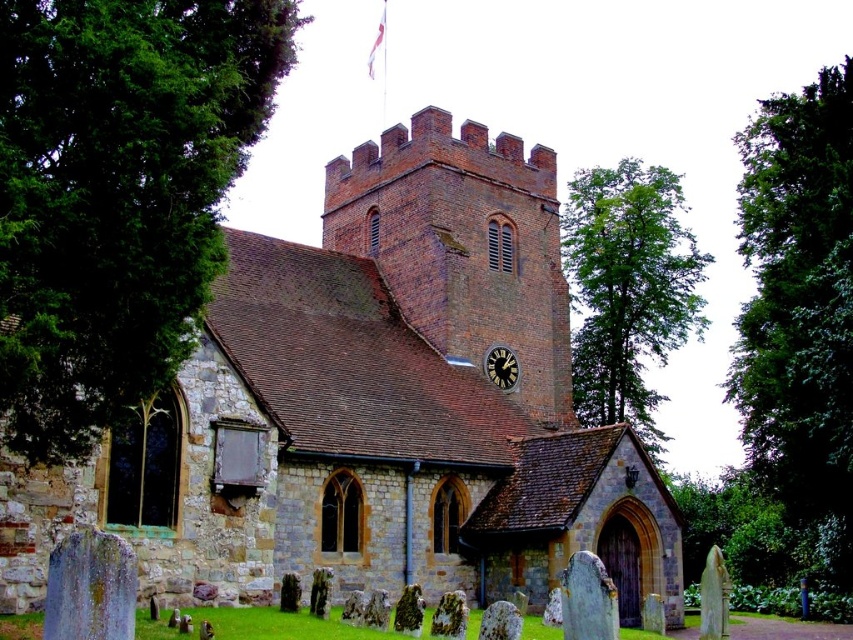
You are standing in front of the traditional English church and want to take a photo. You notice two points marked on the image. The first point is at coordinates point (642,588) and the second point is at point (813,180). Which point will appear larger in your photo?

Point (642,588) will appear larger in the photo because it is closer to the camera than point (813,180).

You are a tourist visiting the church and want to take a photo that includes both the brown stone church at center and the black metal clock at upper center. Which object should you focus on first to ensure both are in frame?

The brown stone church at center is much taller than the black metal clock at upper center, so you should focus on the brown stone church at center first to ensure both are in frame.

You are standing in front of the brown stone church at center and want to look at the black metal clock at upper center. In which direction should you turn your head to see it?

The brown stone church at center is positioned on the left side of black metal clock at upper center, so you should turn your head to the right to see it.